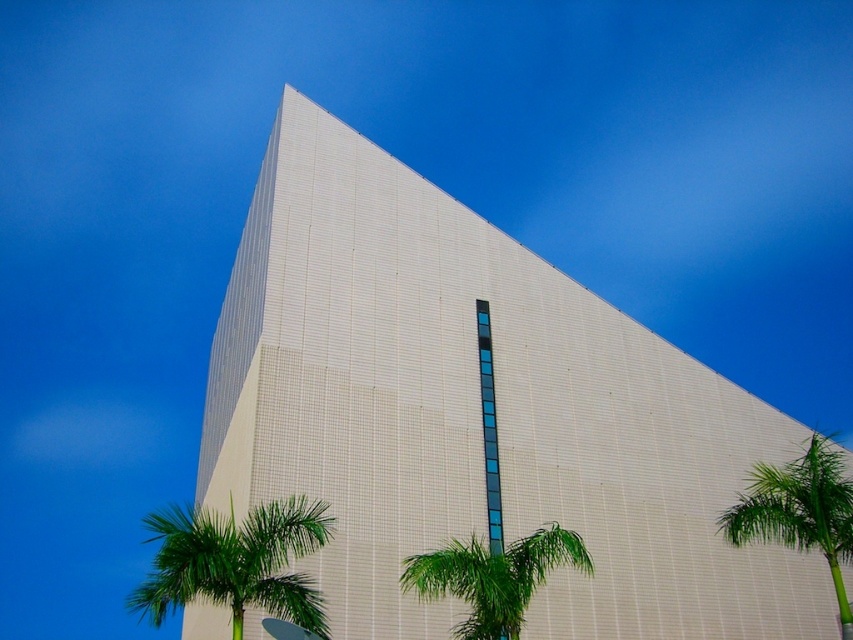
Does green leafy palm tree at lower left have a greater height compared to green leafy palm tree at right?

Indeed, green leafy palm tree at lower left has a greater height compared to green leafy palm tree at right.

Can you confirm if green leafy palm tree at lower left is shorter than green leafy palm tree at right?

No, green leafy palm tree at lower left is not shorter than green leafy palm tree at right.

Describe the element at coordinates (236, 563) in the screenshot. I see `green leafy palm tree at lower left` at that location.

Find the location of a particular element. The image size is (853, 640). green leafy palm tree at lower left is located at coordinates (236, 563).

Does white textured building at center appear on the left side of green leafy palm tree at right?

Correct, you'll find white textured building at center to the left of green leafy palm tree at right.

Is white textured building at center in front of green leafy palm tree at right?

No.

Does point (392, 628) come farther from viewer compared to point (751, 500)?

Yes, point (392, 628) is farther from viewer.

Locate an element on the screen. Image resolution: width=853 pixels, height=640 pixels. white textured building at center is located at coordinates (476, 412).

Between green leafy palm tree at lower left and green leafy palm tree at lower center, which one has more height?

Standing taller between the two is green leafy palm tree at lower left.

Which is above, green leafy palm tree at lower left or green leafy palm tree at lower center?

Positioned higher is green leafy palm tree at lower center.

Is point (254, 545) closer to camera compared to point (582, 563)?

Yes, it is.

Locate an element on the screen. The width and height of the screenshot is (853, 640). green leafy palm tree at lower left is located at coordinates (236, 563).